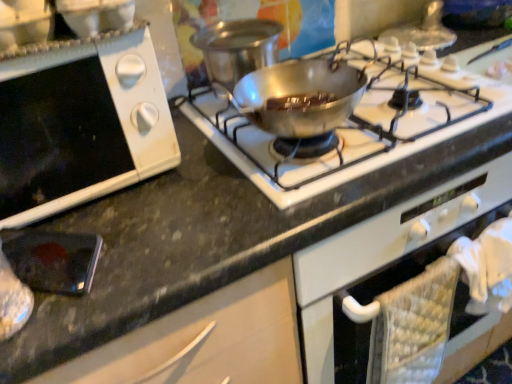
What are the coordinates of `unoccupied space behind metallic silver phone at lower left` in the screenshot? It's located at (129, 203).